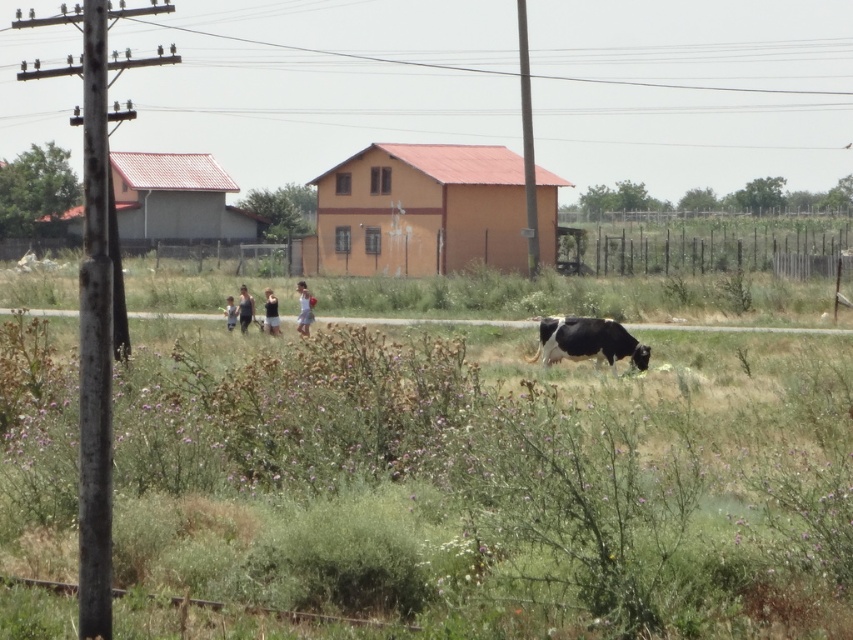
Who is more forward, (637,355) or (242,323)?

Point (637,355) is more forward.

Between black and white spotted bull at center and dark blue tank top at center, which one appears on the left side from the viewer's perspective?

dark blue tank top at center is more to the left.

Between point (570, 342) and point (242, 314), which one is positioned in front?

Point (570, 342) is more forward.

In order to click on black and white spotted bull at center in this screenshot , I will do pyautogui.click(x=587, y=340).

Between point (299, 284) and point (233, 316), which one is positioned behind?

Positioned behind is point (299, 284).

Is white cotton shirt at center thinner than black fabric person at center?

Incorrect, white cotton shirt at center's width is not less than black fabric person at center's.

From the picture: Who is more distant from viewer, (306, 317) or (225, 326)?

The point (225, 326) is more distant.

The image size is (853, 640). Find the location of `white cotton shirt at center`. white cotton shirt at center is located at coordinates (305, 308).

Is black and white spotted bull at center smaller than white cotton shirt at center?

Indeed, black and white spotted bull at center has a smaller size compared to white cotton shirt at center.

Is point (538, 326) positioned after point (300, 316)?

No, it is not.

Does point (538, 349) lie behind point (299, 301)?

No, it is not.

Image resolution: width=853 pixels, height=640 pixels. What are the coordinates of `black and white spotted bull at center` in the screenshot? It's located at (587, 340).